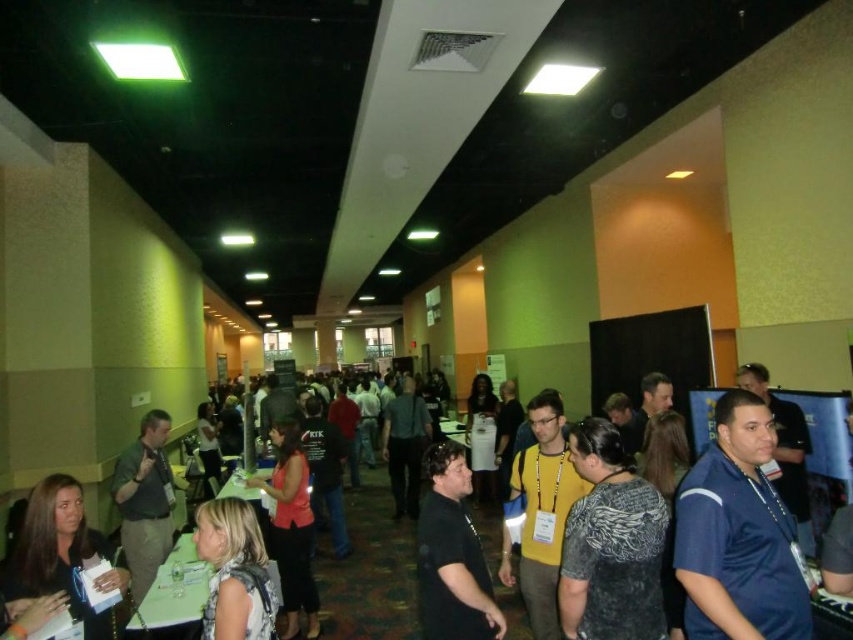
Question: Which of the following is the farthest from the observer?

Choices:
 (A) black matte shirt at center
 (B) blue jersey at center

Answer: (A)

Question: Does blue jersey at center appear on the left side of black matte shirt at center?

Choices:
 (A) no
 (B) yes

Answer: (A)

Question: Does blue jersey at center appear on the right side of black matte shirt at center?

Choices:
 (A) no
 (B) yes

Answer: (B)

Question: Which of the following is the closest to the observer?

Choices:
 (A) (751, 397)
 (B) (469, 595)

Answer: (A)

Question: Which point is closer to the camera taking this photo?

Choices:
 (A) (440, 561)
 (B) (695, 595)

Answer: (B)

Question: Observing the image, what is the correct spatial positioning of blue jersey at center in reference to black matte shirt at center?

Choices:
 (A) below
 (B) above

Answer: (B)